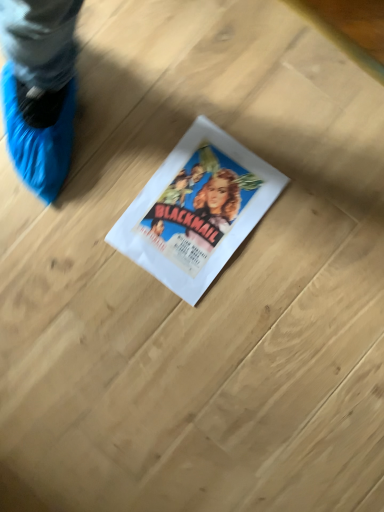
At what (x,y) coordinates should I click in order to perform the action: click on free space above white paper at center (from a real-world perspective). Please return your answer as a coordinate pair (x, y). This screenshot has height=512, width=384. Looking at the image, I should click on (200, 210).